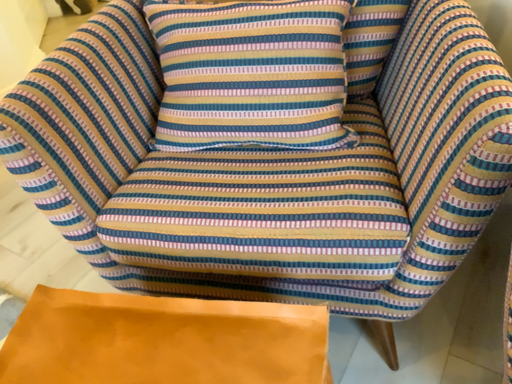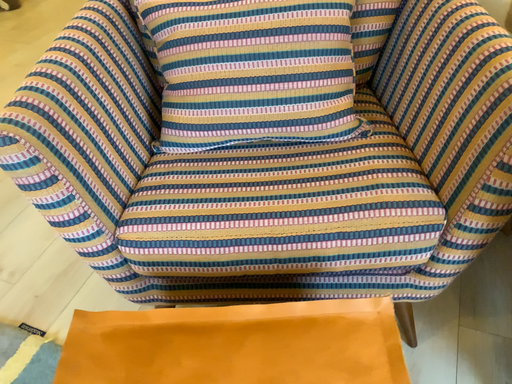
Question: Which way did the camera rotate in the video?

Choices:
 (A) rotated left
 (B) rotated right

Answer: (B)